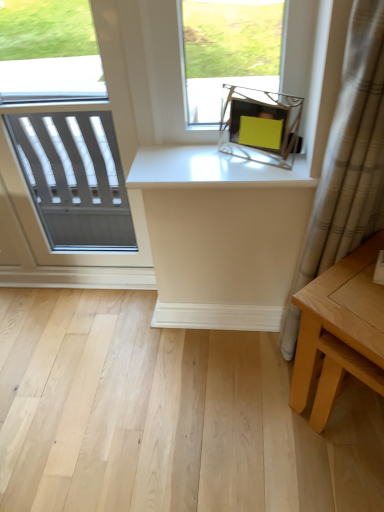
Image resolution: width=384 pixels, height=512 pixels. I want to click on free spot to the left of beige textured curtain at right, so click(x=244, y=367).